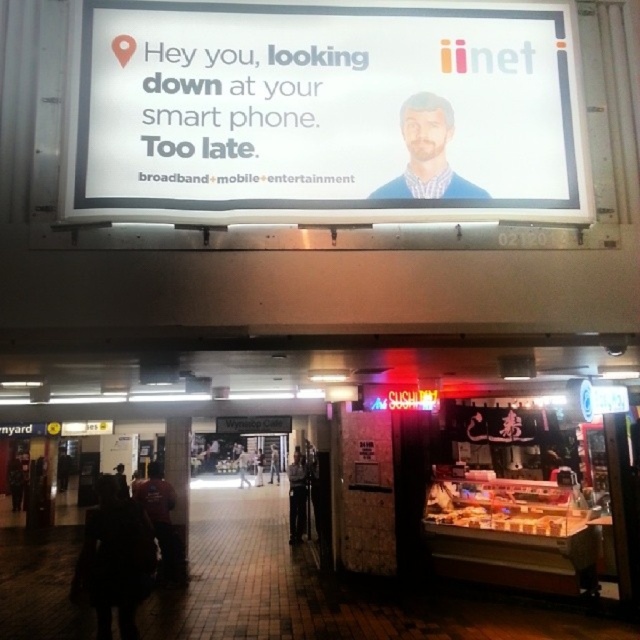
In the scene shown: Who is more distant from viewer, (x=465, y=188) or (x=236, y=458)?

Point (x=236, y=458)

Where is `matte blue shirt at center`? matte blue shirt at center is located at coordinates (428, 154).

Locate an element on the screen. The height and width of the screenshot is (640, 640). matte blue shirt at center is located at coordinates (428, 154).

Looking at this image, can you confirm if dark blue jeans at center is thinner than dark blue sweater at center?

Indeed, dark blue jeans at center has a lesser width compared to dark blue sweater at center.

Does point (298, 513) come in front of point (275, 472)?

Yes.

What do you see at coordinates (296, 497) in the screenshot? I see `dark blue jeans at center` at bounding box center [296, 497].

Locate an element on the screen. The height and width of the screenshot is (640, 640). dark blue jeans at center is located at coordinates (296, 497).

The height and width of the screenshot is (640, 640). In order to click on matte blue shirt at center in this screenshot , I will do `click(428, 154)`.

Which is above, matte blue shirt at center or dark blue sweater at center?

Positioned higher is matte blue shirt at center.

Is point (416, 180) positioned behind point (276, 448)?

No, (416, 180) is in front of (276, 448).

Identify the location of matte blue shirt at center. (428, 154).